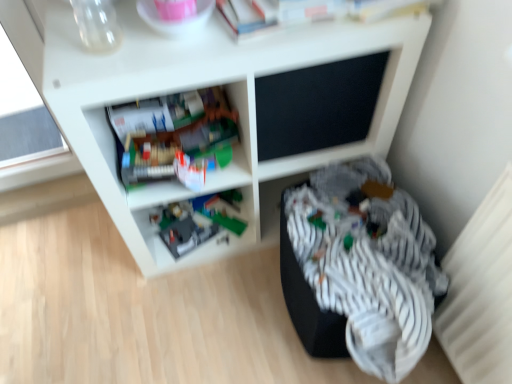
Image resolution: width=512 pixels, height=384 pixels. I want to click on free location to the left of white matte shelf at center, which appears as the second shelf when viewed from the back, so click(x=70, y=277).